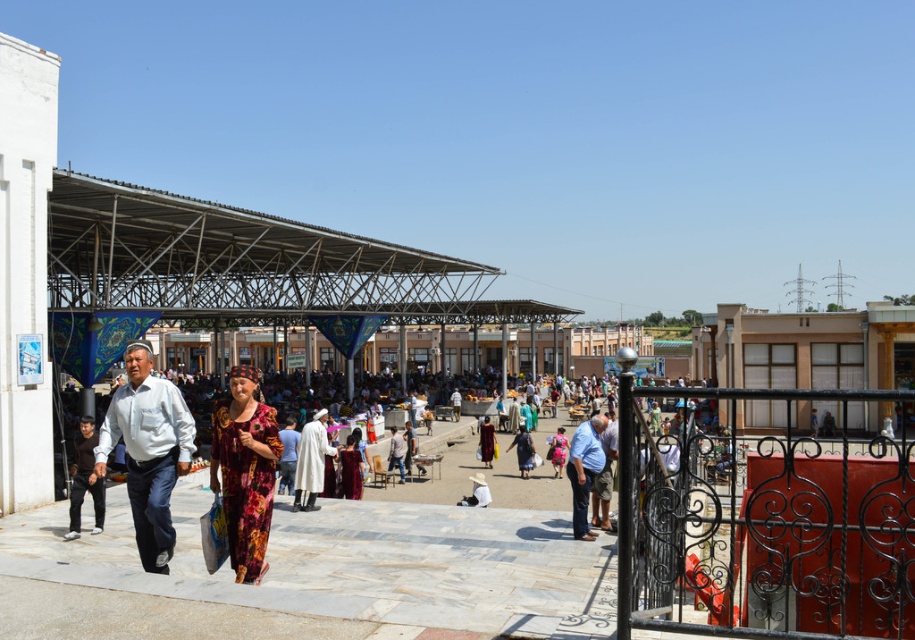
You are a customer at the market and see two dresses displayed at the center. Which dress is closer to you, the floral fabric dress at center or the light brown fabric dress at center?

The floral fabric dress at center is closer to you because it is in front of the light brown fabric dress at center.